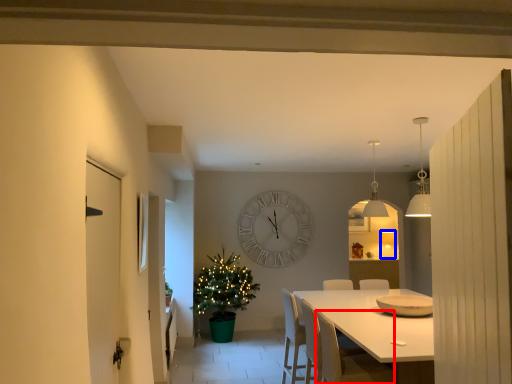
Question: Which of the following is the farthest to the observer, armchair (highlighted by a red box) or lamp (highlighted by a blue box)?

Choices:
 (A) armchair
 (B) lamp

Answer: (B)